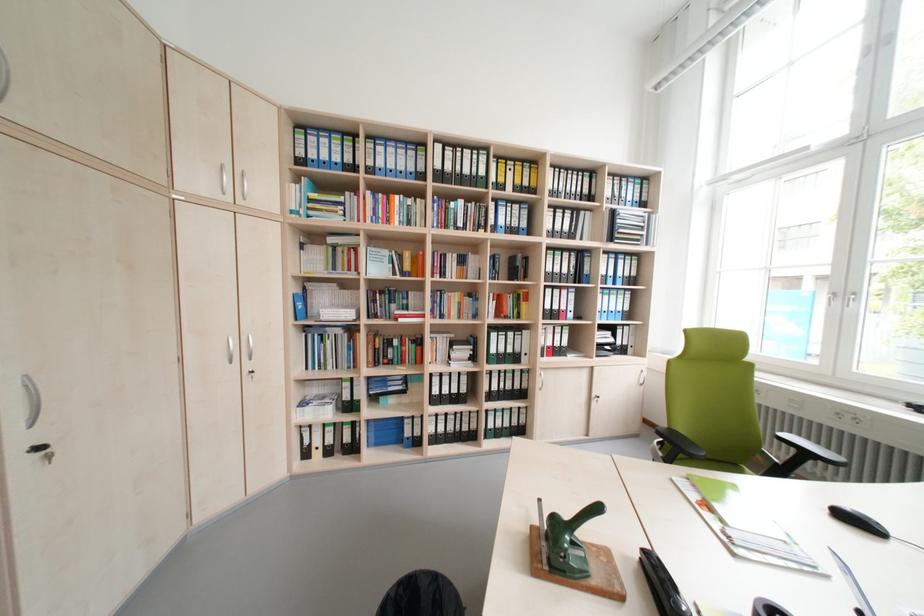
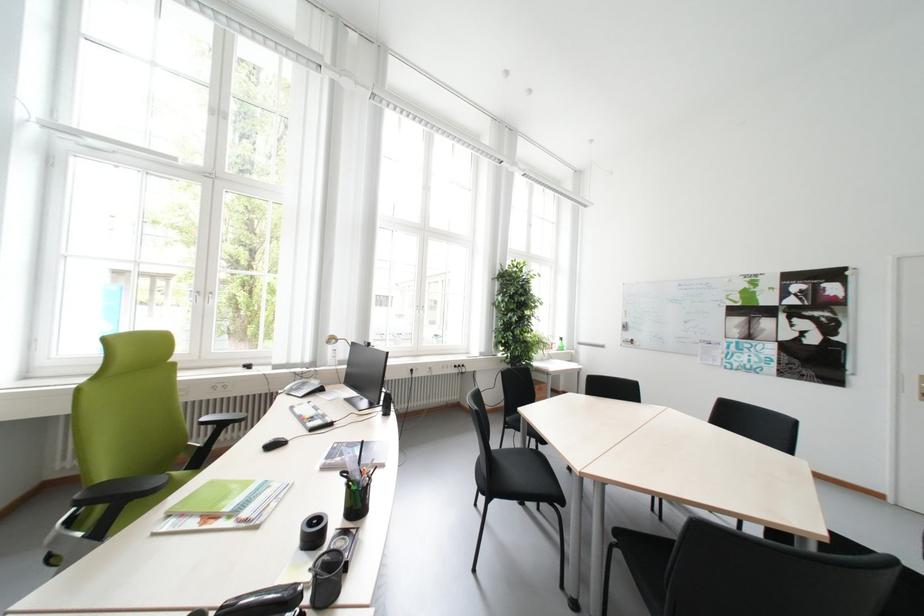
In the second image, find the point that corresponds to point 855,296 in the first image.

(213, 294)